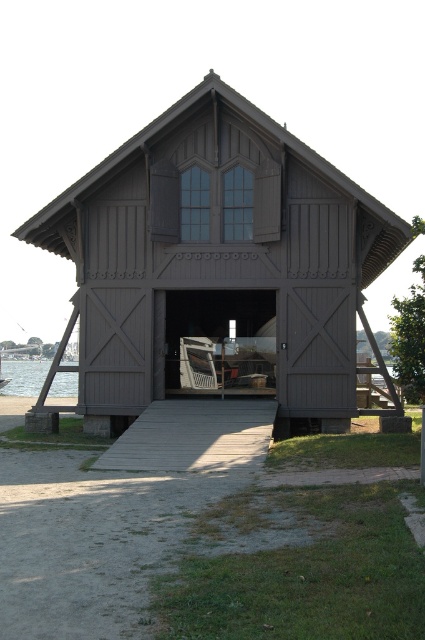
Is matte brown wooden barn at center positioned at the back of wooden ramp at center?

Yes, it is.

From the picture: Can you confirm if matte brown wooden barn at center is positioned below wooden ramp at center?

No, matte brown wooden barn at center is not below wooden ramp at center.

This screenshot has width=425, height=640. Describe the element at coordinates (220, 262) in the screenshot. I see `matte brown wooden barn at center` at that location.

The height and width of the screenshot is (640, 425). Identify the location of matte brown wooden barn at center. (220, 262).

Which is behind, point (354, 276) or point (200, 342)?

The point (200, 342) is behind.

Between point (184, 156) and point (198, 385), which one is positioned behind?

Positioned behind is point (198, 385).

Find the location of a particular element. The width and height of the screenshot is (425, 640). matte brown wooden barn at center is located at coordinates (220, 262).

Does point (340, 358) lie behind point (70, 394)?

That is False.

Which of these two, matte brown wooden barn at center or clear water at lower left, stands shorter?

With less height is clear water at lower left.

Locate an element on the screen. The image size is (425, 640). matte brown wooden barn at center is located at coordinates (220, 262).

The width and height of the screenshot is (425, 640). What are the coordinates of `matte brown wooden barn at center` in the screenshot? It's located at (220, 262).